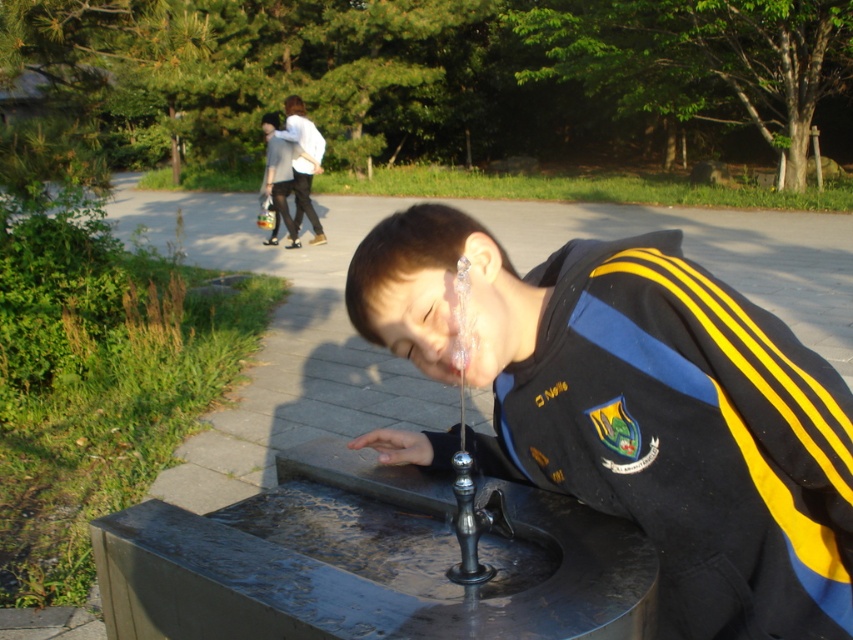
Does shiny black jacket at center appear on the left side of polished metal faucet at center?

No, shiny black jacket at center is not to the left of polished metal faucet at center.

Is shiny black jacket at center to the right of polished metal faucet at center from the viewer's perspective?

Indeed, shiny black jacket at center is positioned on the right side of polished metal faucet at center.

Is point (709, 384) behind point (469, 579)?

No, it is not.

The width and height of the screenshot is (853, 640). Find the location of `shiny black jacket at center`. shiny black jacket at center is located at coordinates [641, 410].